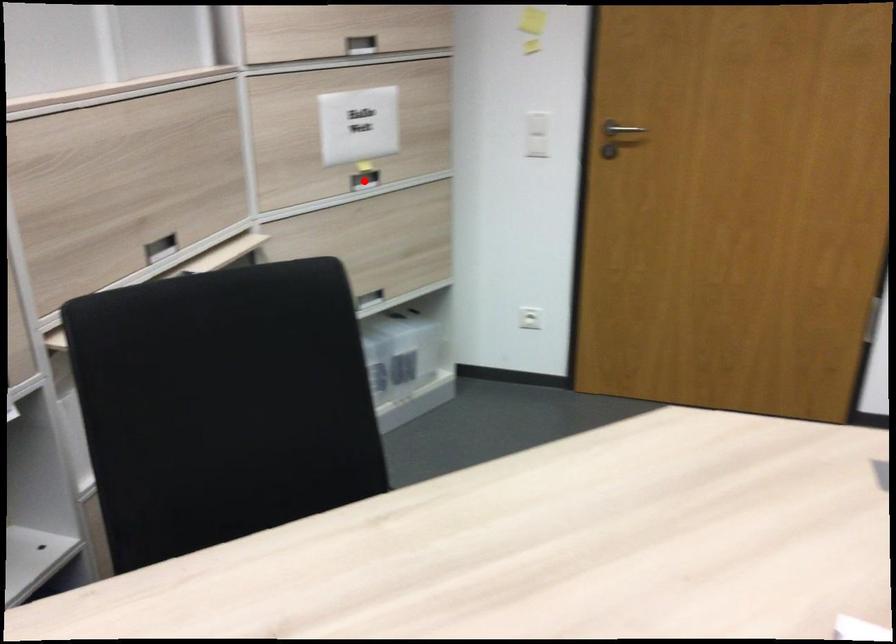
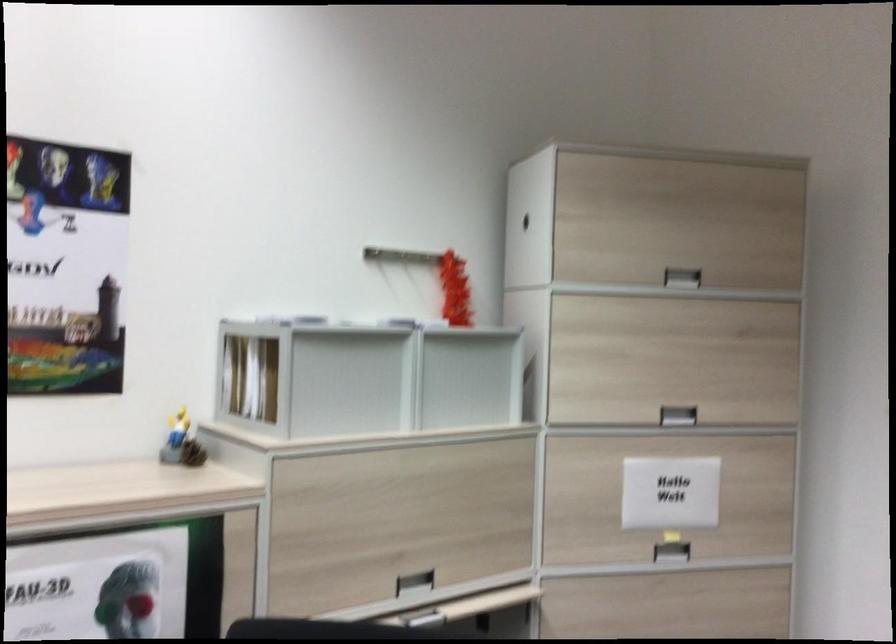
Locate, in the second image, the point that corresponds to the highlighted location in the first image.

(670, 552)